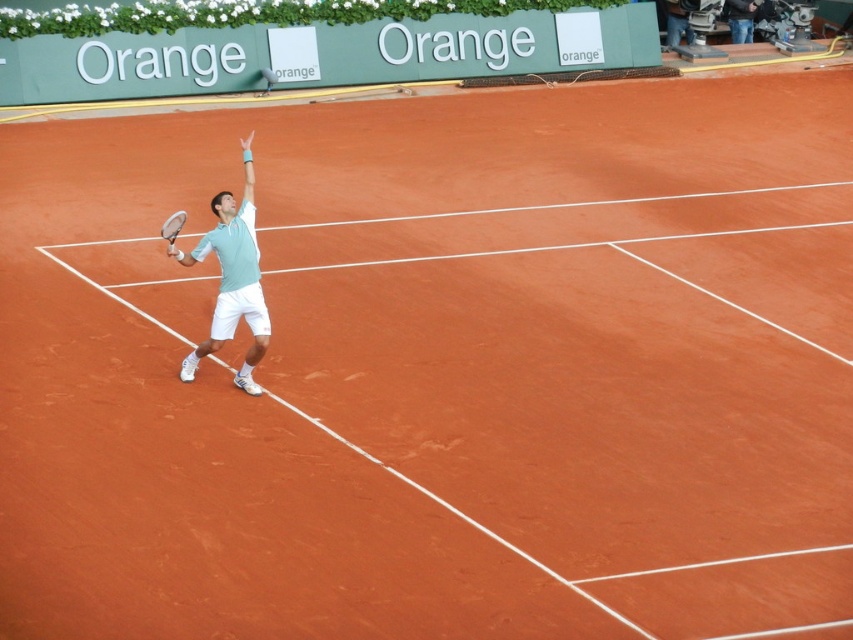
Can you confirm if light blue fabric shirt at center is positioned above white matte tennis racket at center-left?

No.

Does light blue fabric shirt at center have a larger size compared to white matte tennis racket at center-left?

Yes.

Image resolution: width=853 pixels, height=640 pixels. What do you see at coordinates (231, 278) in the screenshot? I see `light blue fabric shirt at center` at bounding box center [231, 278].

I want to click on light blue fabric shirt at center, so click(x=231, y=278).